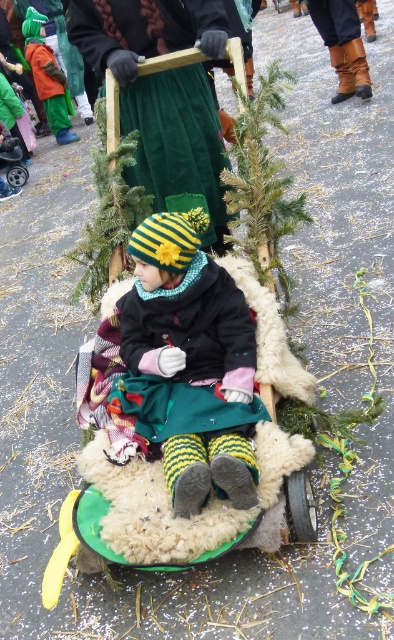
Question: Can you confirm if knitted woolen hat at center is positioned above velvety green skirt at center?

Choices:
 (A) no
 (B) yes

Answer: (A)

Question: Is knitted woolen hat at center below velvety green skirt at center?

Choices:
 (A) yes
 (B) no

Answer: (A)

Question: Which point is farther from the camera taking this photo?

Choices:
 (A) (198, 512)
 (B) (144, 17)

Answer: (B)

Question: Which object appears farthest from the camera in this image?

Choices:
 (A) knitted woolen hat at center
 (B) velvety green skirt at center

Answer: (B)

Question: Can you confirm if knitted woolen hat at center is bigger than velvety green skirt at center?

Choices:
 (A) yes
 (B) no

Answer: (B)